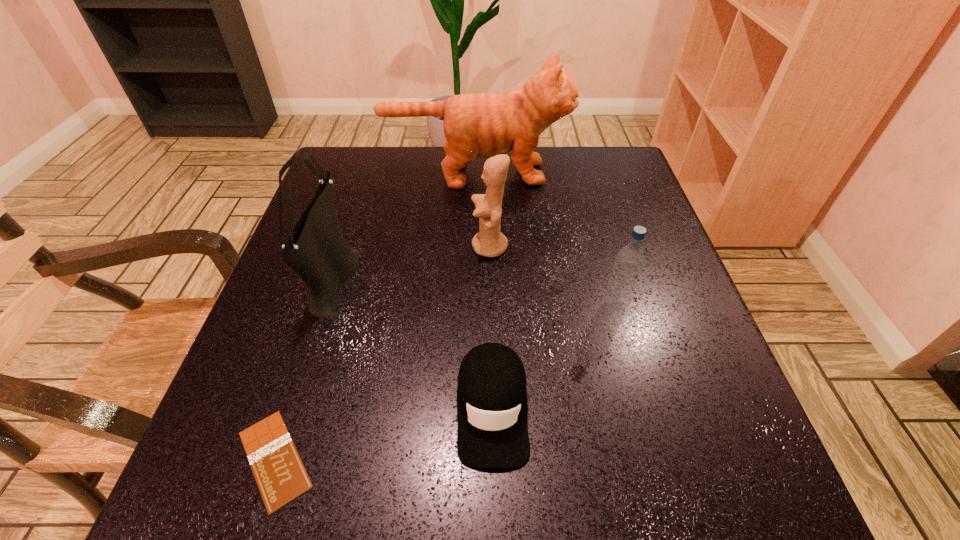
Find the location of `object that stands as the closest to the chocolate bar`. object that stands as the closest to the chocolate bar is located at coordinates (316, 250).

Where is `vacant space that satisfies the following two spatial constraints: 1. on the front-facing side of the figurine; 2. on the right side of the third shortest object`? The width and height of the screenshot is (960, 540). vacant space that satisfies the following two spatial constraints: 1. on the front-facing side of the figurine; 2. on the right side of the third shortest object is located at coordinates (492, 306).

At what (x,y) coordinates should I click in order to perform the action: click on free region that satisfies the following two spatial constraints: 1. on the front-facing side of the water bottle; 2. on the left side of the figurine. Please return your answer as a coordinate pair (x, y). Image resolution: width=960 pixels, height=540 pixels. Looking at the image, I should click on (492, 306).

The height and width of the screenshot is (540, 960). What are the coordinates of `vacant region that satisfies the following two spatial constraints: 1. on the back side of the third shortest object; 2. on the face of the cat` in the screenshot? It's located at (578, 173).

This screenshot has width=960, height=540. What are the coordinates of `vacant region that satisfies the following two spatial constraints: 1. on the front-facing side of the figurine; 2. on the front side of the shoulder bag` in the screenshot? It's located at (491, 277).

At what (x,y) coordinates should I click in order to perform the action: click on free spot that satisfies the following two spatial constraints: 1. on the front-facing side of the figurine; 2. on the front side of the shortest object. Please return your answer as a coordinate pair (x, y). Image resolution: width=960 pixels, height=540 pixels. Looking at the image, I should click on (494, 459).